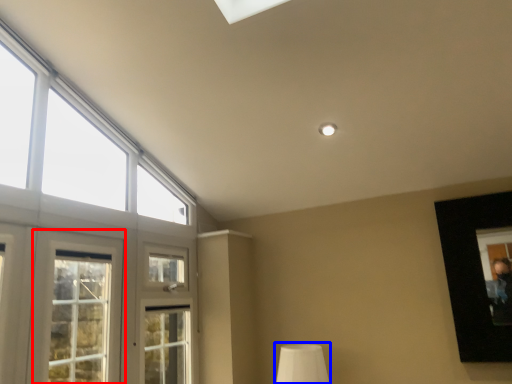
Question: Which object is further to the camera taking this photo, window (highlighted by a red box) or table lamp (highlighted by a blue box)?

Choices:
 (A) window
 (B) table lamp

Answer: (B)